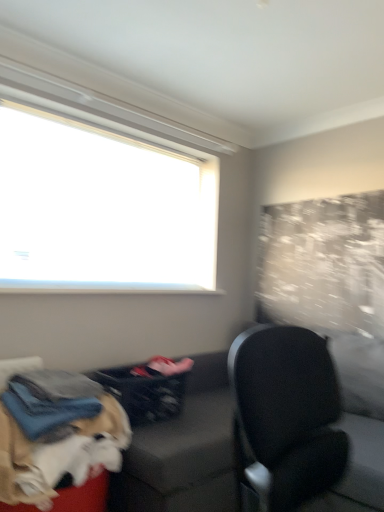
You are a GUI agent. You are given a task and a screenshot of the screen. Output one action in this format:
    pyautogui.click(x=<x>, y=<y>)
    Task: Click on the dark gray fabric laundry basket at lower center
    This screenshot has width=384, height=512.
    Given the screenshot: What is the action you would take?
    pyautogui.click(x=148, y=388)

Where is `white fluffy dog at lower left`? white fluffy dog at lower left is located at coordinates point(60,460).

The image size is (384, 512). Describe the element at coordinates (287, 414) in the screenshot. I see `black leather chair at right` at that location.

Where is `dark gray fabric couch at lower left`? This screenshot has width=384, height=512. dark gray fabric couch at lower left is located at coordinates (298, 424).

Identify the location of dark gray fabric laundry basket at lower center. The image size is (384, 512). (148, 388).

Based on the photo, which object is further away from the camera, dark gray fabric laundry basket at lower center or white fluffy dog at lower left?

Positioned behind is dark gray fabric laundry basket at lower center.

Locate an element on the screen. This screenshot has height=512, width=384. laundry basket positioned vertically above the white fluffy dog at lower left (from a real-world perspective) is located at coordinates (148, 388).

Is dark gray fabric laundry basket at lower center to the left or to the right of white fluffy dog at lower left in the image?

Clearly, dark gray fabric laundry basket at lower center is on the right of white fluffy dog at lower left in the image.

Identify the location of laundry basket on the left of dark gray fabric couch at lower left. The image size is (384, 512). (148, 388).

Is point (146, 392) positioned before point (253, 367)?

No, it is not.

Is dark gray fabric couch at lower left located within dark gray fabric laundry basket at lower center?

That's incorrect, dark gray fabric couch at lower left is not inside dark gray fabric laundry basket at lower center.

Can you confirm if dark gray fabric laundry basket at lower center is thinner than dark gray fabric couch at lower left?

Correct, the width of dark gray fabric laundry basket at lower center is less than that of dark gray fabric couch at lower left.

Can you confirm if white fluffy dog at lower left is taller than dark gray fabric laundry basket at lower center?

Yes, white fluffy dog at lower left is taller than dark gray fabric laundry basket at lower center.

Between point (93, 501) and point (150, 379), which one is positioned behind?

The point (150, 379) is farther from the camera.

Which of these two, white fluffy dog at lower left or dark gray fabric laundry basket at lower center, is thinner?

With smaller width is dark gray fabric laundry basket at lower center.

Between white fluffy dog at lower left and dark gray fabric couch at lower left, which one has larger size?

dark gray fabric couch at lower left is bigger.

Is dark gray fabric couch at lower left at the back of white fluffy dog at lower left?

No, white fluffy dog at lower left's orientation is not away from dark gray fabric couch at lower left.

Considering the sizes of white fluffy dog at lower left and dark gray fabric couch at lower left in the image, is white fluffy dog at lower left taller or shorter than dark gray fabric couch at lower left?

Clearly, white fluffy dog at lower left is shorter compared to dark gray fabric couch at lower left.

Is black leather chair at right located within dark gray fabric laundry basket at lower center?

That's incorrect, black leather chair at right is not inside dark gray fabric laundry basket at lower center.

Is point (155, 360) farther from camera compared to point (308, 359)?

Yes, it is behind point (308, 359).

Is dark gray fabric laundry basket at lower center positioned behind black leather chair at right?

Yes, it is behind black leather chair at right.

I want to click on laundry basket that is above the black leather chair at right (from a real-world perspective), so click(x=148, y=388).

Are dark gray fabric couch at lower left and dark gray fabric laundry basket at lower center beside each other?

No, dark gray fabric couch at lower left is not touching dark gray fabric laundry basket at lower center.

Which is behind, dark gray fabric couch at lower left or dark gray fabric laundry basket at lower center?

dark gray fabric laundry basket at lower center is behind.

Does dark gray fabric couch at lower left turn towards dark gray fabric laundry basket at lower center?

Yes, dark gray fabric couch at lower left is facing dark gray fabric laundry basket at lower center.

Does dark gray fabric couch at lower left have a greater width compared to dark gray fabric laundry basket at lower center?

Yes, dark gray fabric couch at lower left is wider than dark gray fabric laundry basket at lower center.

Considering the relative sizes of black leather chair at right and dark gray fabric couch at lower left in the image provided, is black leather chair at right thinner than dark gray fabric couch at lower left?

Incorrect, the width of black leather chair at right is not less than that of dark gray fabric couch at lower left.

The height and width of the screenshot is (512, 384). Find the location of `studio couch that appears above the black leather chair at right (from a real-world perspective)`. studio couch that appears above the black leather chair at right (from a real-world perspective) is located at coordinates (298, 424).

Does black leather chair at right appear on the left side of dark gray fabric couch at lower left?

No.

Are black leather chair at right and dark gray fabric couch at lower left beside each other?

Yes, black leather chair at right is with dark gray fabric couch at lower left.

Identify the location of dog directly beneath the dark gray fabric laundry basket at lower center (from a real-world perspective). (60, 460).

I want to click on laundry basket on the left of the dark gray fabric couch at lower left, so click(148, 388).

From the picture: When comparing their distances from black leather chair at right, does dark gray fabric couch at lower left or white fluffy dog at lower left seem closer?

Based on the image, dark gray fabric couch at lower left appears to be nearer to black leather chair at right.

Consider the image. From the image, which object appears to be farther from dark gray fabric couch at lower left, dark gray fabric laundry basket at lower center or white fluffy dog at lower left?

Among the two, dark gray fabric laundry basket at lower center is located further to dark gray fabric couch at lower left.

Considering their positions, is dark gray fabric laundry basket at lower center positioned further to black leather chair at right than white fluffy dog at lower left?

dark gray fabric laundry basket at lower center.

Estimate the real-world distances between objects in this image. Which object is closer to dark gray fabric couch at lower left, dark gray fabric laundry basket at lower center or black leather chair at right?

black leather chair at right is closer to dark gray fabric couch at lower left.

Looking at the image, which one is located further to black leather chair at right, white fluffy dog at lower left or dark gray fabric couch at lower left?

The object further to black leather chair at right is white fluffy dog at lower left.

From the image, which object appears to be farther from dark gray fabric laundry basket at lower center, white fluffy dog at lower left or black leather chair at right?

Based on the image, black leather chair at right appears to be further to dark gray fabric laundry basket at lower center.

Considering their positions, is black leather chair at right positioned closer to dark gray fabric laundry basket at lower center than white fluffy dog at lower left?

The object closer to dark gray fabric laundry basket at lower center is white fluffy dog at lower left.

Which object lies nearer to the anchor point white fluffy dog at lower left, dark gray fabric laundry basket at lower center or dark gray fabric couch at lower left?

dark gray fabric laundry basket at lower center.

The image size is (384, 512). Identify the location of studio couch between white fluffy dog at lower left and black leather chair at right. (298, 424).

This screenshot has height=512, width=384. Find the location of `studio couch located between dark gray fabric laundry basket at lower center and black leather chair at right in the left-right direction`. studio couch located between dark gray fabric laundry basket at lower center and black leather chair at right in the left-right direction is located at coordinates (298, 424).

The image size is (384, 512). Find the location of `laundry basket between white fluffy dog at lower left and black leather chair at right from left to right`. laundry basket between white fluffy dog at lower left and black leather chair at right from left to right is located at coordinates [x=148, y=388].

At what (x,y) coordinates should I click in order to perform the action: click on laundry basket between white fluffy dog at lower left and dark gray fabric couch at lower left in the horizontal direction. Please return your answer as a coordinate pair (x, y). Image resolution: width=384 pixels, height=512 pixels. Looking at the image, I should click on (148, 388).